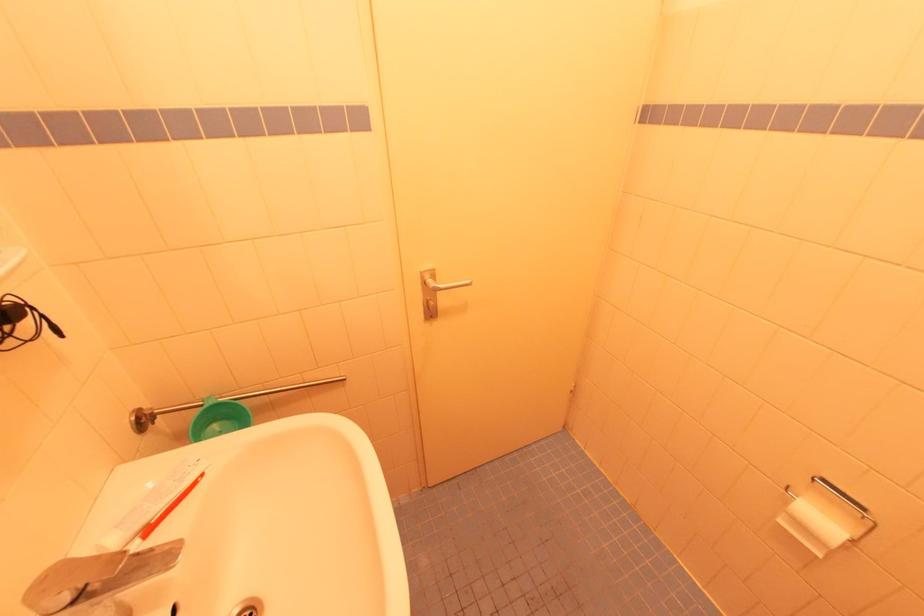
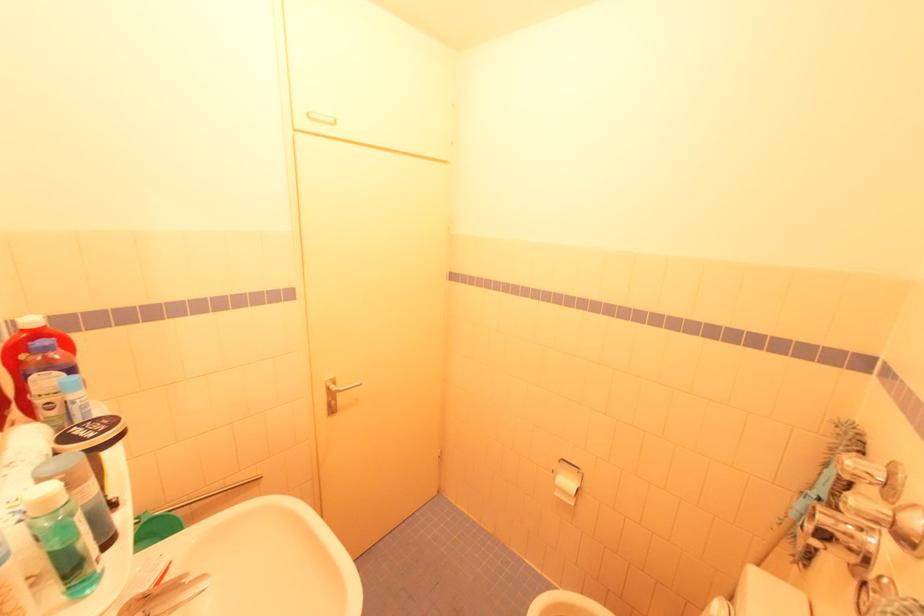
Question: What movement of the cameraman would produce the second image?

Choices:
 (A) Left
 (B) Right
 (C) Forward
 (D) Backward

Answer: (D)